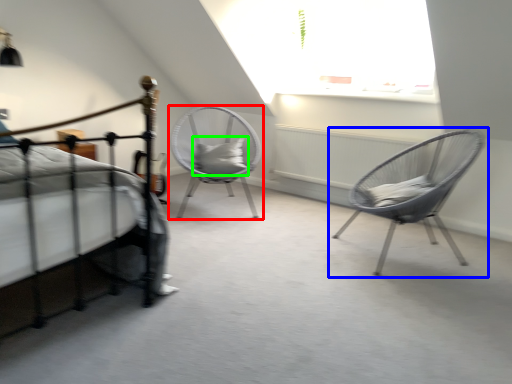
Question: Which is farther away from chair (highlighted by a red box)? chair (highlighted by a blue box) or pillow (highlighted by a green box)?

Choices:
 (A) chair
 (B) pillow

Answer: (A)